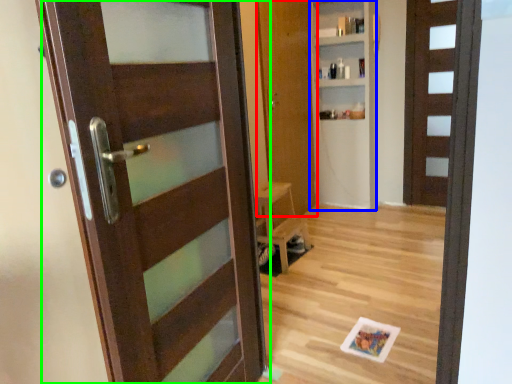
Question: Considering the real-world distances, which object is closest to door (highlighted by a red box)? bookshelf (highlighted by a blue box) or door (highlighted by a green box).

Choices:
 (A) bookshelf
 (B) door

Answer: (A)